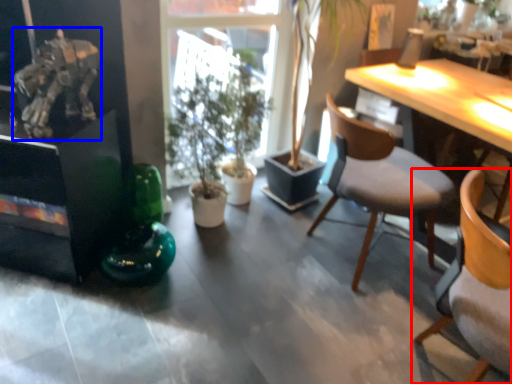
Question: Which object is closer to the camera taking this photo, chair (highlighted by a red box) or art (highlighted by a blue box)?

Choices:
 (A) chair
 (B) art

Answer: (A)